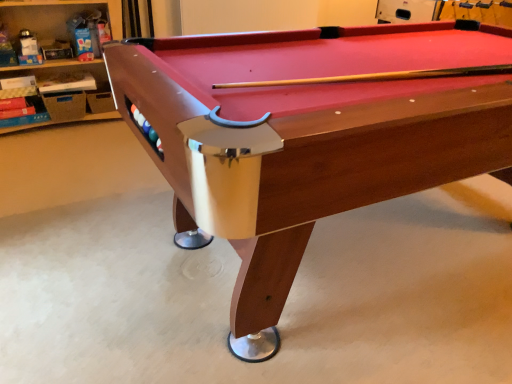
Question: Would you say wooden pool table at center contains wooden shelves at left?

Choices:
 (A) no
 (B) yes

Answer: (A)

Question: Does wooden pool table at center have a smaller size compared to wooden shelves at left?

Choices:
 (A) no
 (B) yes

Answer: (A)

Question: Is wooden pool table at center at the left side of wooden shelves at left?

Choices:
 (A) yes
 (B) no

Answer: (B)

Question: From the image's perspective, is wooden pool table at center located above wooden shelves at left?

Choices:
 (A) yes
 (B) no

Answer: (B)

Question: Could you tell me if wooden pool table at center is turned towards wooden shelves at left?

Choices:
 (A) no
 (B) yes

Answer: (A)

Question: Is wooden pool table at center beside wooden shelves at left?

Choices:
 (A) yes
 (B) no

Answer: (B)

Question: Does wooden shelves at left have a larger size compared to wooden pool table at center?

Choices:
 (A) no
 (B) yes

Answer: (A)

Question: Considering the relative sizes of wooden shelves at left and wooden pool table at center in the image provided, is wooden shelves at left smaller than wooden pool table at center?

Choices:
 (A) yes
 (B) no

Answer: (A)

Question: Is wooden shelves at left at the left side of wooden pool table at center?

Choices:
 (A) yes
 (B) no

Answer: (A)

Question: Is wooden shelves at left taller than wooden pool table at center?

Choices:
 (A) no
 (B) yes

Answer: (A)

Question: Would you say wooden shelves at left is a long distance from wooden pool table at center?

Choices:
 (A) no
 (B) yes

Answer: (B)

Question: Is wooden shelves at left facing away from wooden pool table at center?

Choices:
 (A) no
 (B) yes

Answer: (A)

Question: Is wooden pool table at center bigger or smaller than wooden shelves at left?

Choices:
 (A) small
 (B) big

Answer: (B)